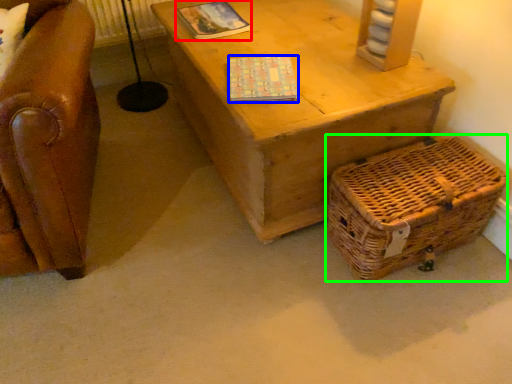
Question: Which object is positioned farthest from magazine (highlighted by a red box)? Select from magazine (highlighted by a blue box) and basket (highlighted by a green box).

Choices:
 (A) magazine
 (B) basket

Answer: (B)